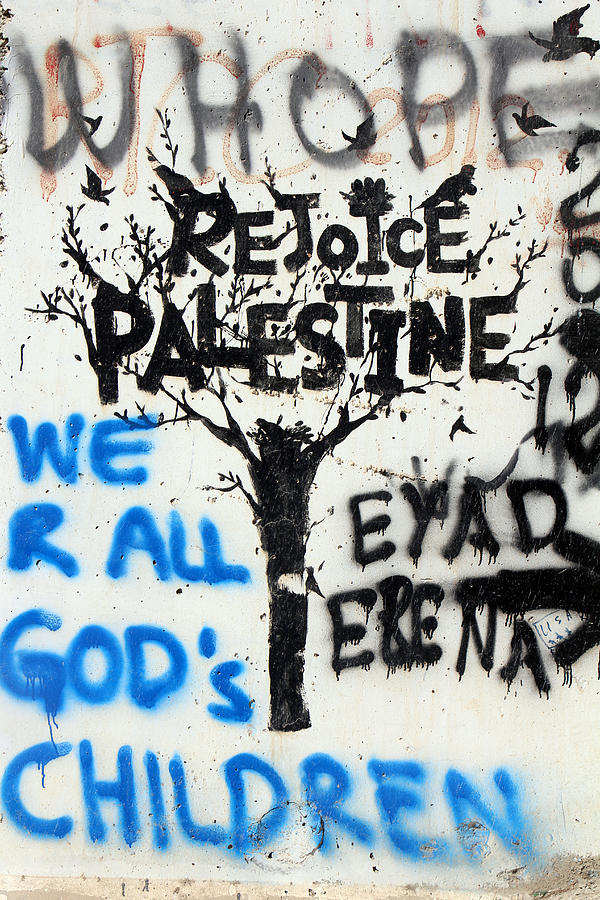
Find the location of `faded light brown word on wall`. faded light brown word on wall is located at coordinates (158, 112).